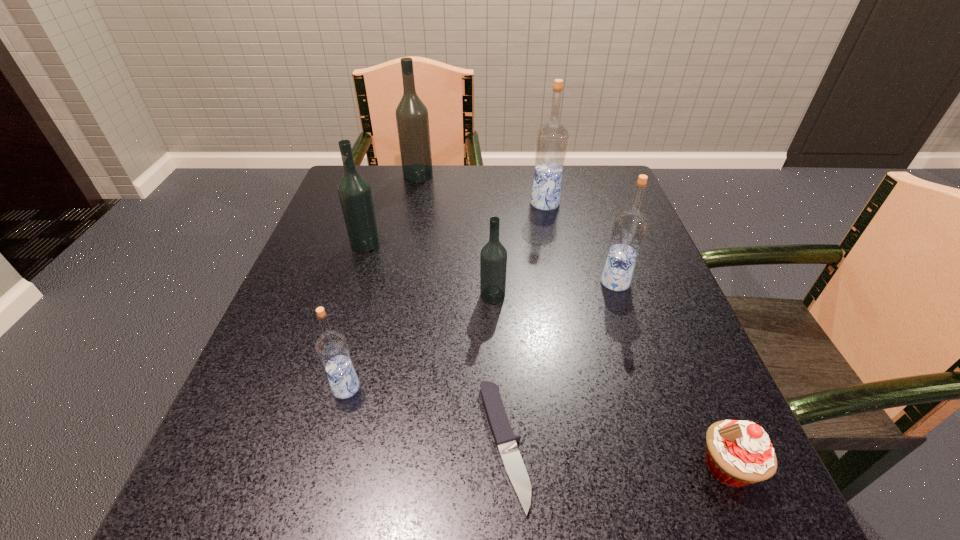
Locate an element on the screen. The image size is (960, 540). the second black vodka from left to right is located at coordinates (412, 119).

Locate an element on the screen. This screenshot has height=540, width=960. the biggest black vodka is located at coordinates (412, 119).

Locate an element on the screen. This screenshot has height=540, width=960. the biggest blue vodka is located at coordinates (552, 138).

At what (x,y) coordinates should I click in order to perform the action: click on the second blue vodka from left to right. Please return your answer as a coordinate pair (x, y). Image resolution: width=960 pixels, height=540 pixels. Looking at the image, I should click on (552, 138).

Where is `the rightmost blue vodka`? Image resolution: width=960 pixels, height=540 pixels. the rightmost blue vodka is located at coordinates (629, 228).

This screenshot has height=540, width=960. I want to click on the rightmost vodka, so click(629, 228).

I want to click on the leftmost black vodka, so click(x=354, y=191).

Locate an element on the screen. This screenshot has width=960, height=540. the third farthest vodka is located at coordinates (354, 191).

The height and width of the screenshot is (540, 960). What are the coordinates of `the smallest blue vodka` in the screenshot? It's located at (332, 347).

This screenshot has width=960, height=540. In order to click on the leftmost blue vodka in this screenshot , I will do `click(332, 347)`.